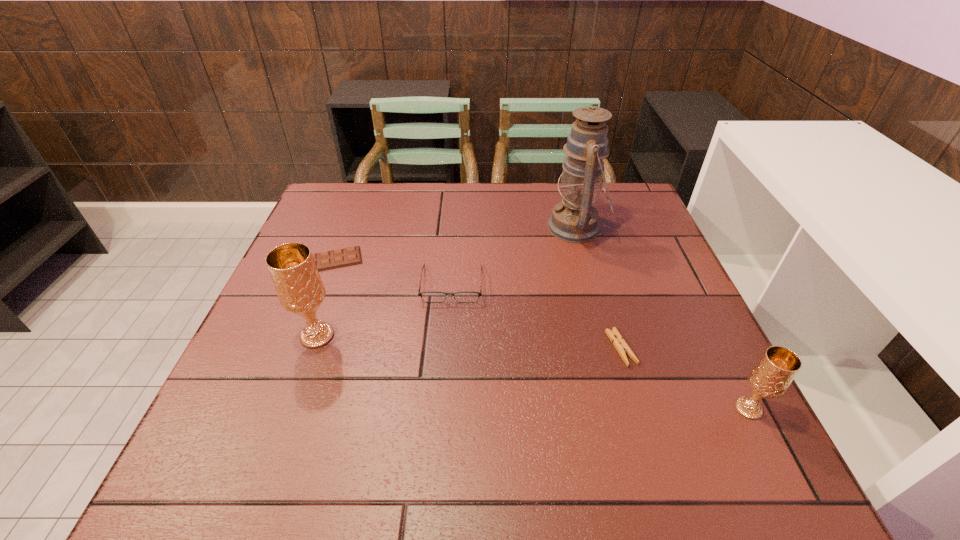
The width and height of the screenshot is (960, 540). What are the coordinates of `the farther chalice` in the screenshot? It's located at (295, 276).

The width and height of the screenshot is (960, 540). Find the location of `the left chalice`. the left chalice is located at coordinates (295, 276).

Find the location of a particular element. Image resolution: width=960 pixels, height=540 pixels. the rightmost object is located at coordinates (771, 376).

This screenshot has height=540, width=960. Find the location of `the right chalice`. the right chalice is located at coordinates (771, 376).

Find the location of a particular element. The width and height of the screenshot is (960, 540). the tallest object is located at coordinates (574, 219).

The height and width of the screenshot is (540, 960). I want to click on the fourth tallest object, so click(x=430, y=296).

Locate an element on the screen. The height and width of the screenshot is (540, 960). spectacles is located at coordinates (430, 296).

You are a GUI agent. You are given a task and a screenshot of the screen. Output one action in this format:
    pyautogui.click(x=<x>, y=<y>)
    Task: Click on the chocolate bar
    This screenshot has width=960, height=540.
    Given the screenshot: What is the action you would take?
    pyautogui.click(x=328, y=260)

Where is `clothespin`? Image resolution: width=960 pixels, height=540 pixels. clothespin is located at coordinates (621, 346).

Identify the location of vacant space located 0.340m on the back of the fifth shortest object. The width and height of the screenshot is (960, 540). (354, 231).